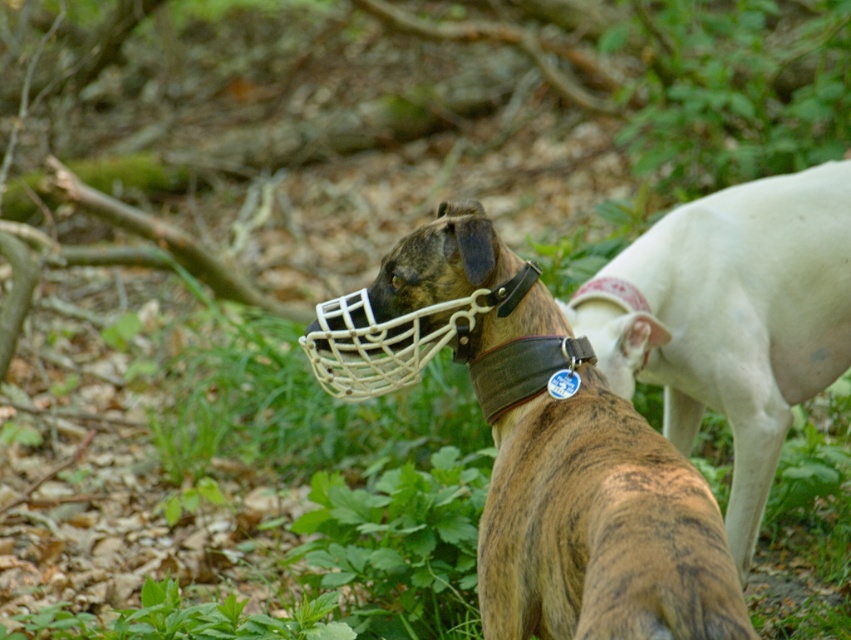
You are a wildlife photographer trying to capture both the brown brindle dog at center and the white smooth dog at right in the same frame. Based on their positions and sizes, which dog appears smaller in the photo?

The brown brindle dog at center appears smaller in the photo because it has a lesser height compared to the white smooth dog at right.

You are a hiker who wants to retrieve the brown canvas collar at center from the white smooth dog at right. The leash you have is 3 feet long. Can you safely reach the collar without getting too close to the dog?

The distance between the white smooth dog at right and the brown canvas collar at center is 3.75 feet. Since your leash is only 3 feet long, you cannot safely reach the collar as the distance exceeds the leash length.